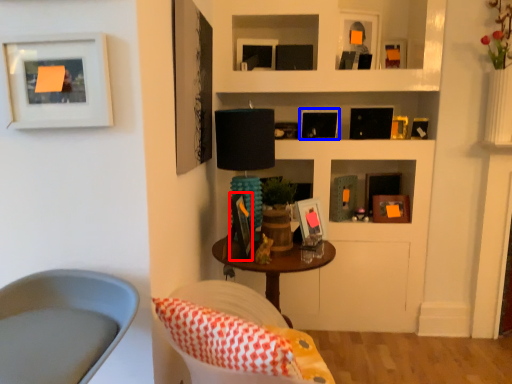
Question: Among these objects, which one is farthest to the camera, picture frame (highlighted by a red box) or picture frame (highlighted by a blue box)?

Choices:
 (A) picture frame
 (B) picture frame

Answer: (B)